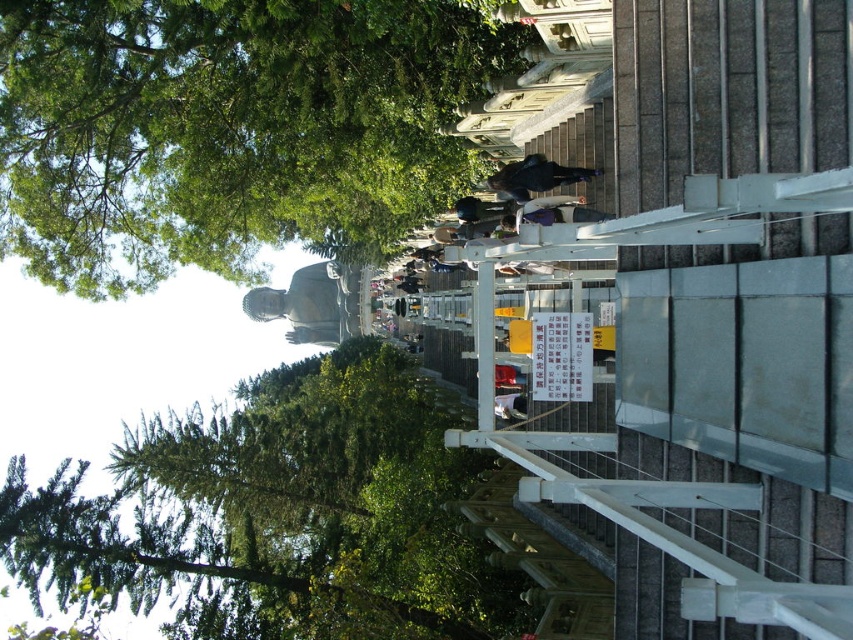
Is the position of green leafy tree at upper left more distant than that of green leafy tree at lower left?

No.

How distant is green leafy tree at upper left from green leafy tree at lower left?

green leafy tree at upper left is 18.46 meters away from green leafy tree at lower left.

Which is in front, point (65, 132) or point (339, 444)?

Point (65, 132)

At what (x,y) coordinates should I click in order to perform the action: click on green leafy tree at upper left. Please return your answer as a coordinate pair (x, y). Looking at the image, I should click on (230, 129).

Can you confirm if green leafy tree at lower left is positioned above dark blue jeans at center?

Actually, green leafy tree at lower left is below dark blue jeans at center.

Which is below, green leafy tree at lower left or dark blue jeans at center?

green leafy tree at lower left

Where is `green leafy tree at lower left`? green leafy tree at lower left is located at coordinates (279, 513).

Is green leafy tree at upper left below matte gray statue at center?

No.

Between green leafy tree at upper left and matte gray statue at center, which one appears on the left side from the viewer's perspective?

Positioned to the left is matte gray statue at center.

Who is more forward, (485, 32) or (270, 300)?

Point (485, 32) is more forward.

I want to click on green leafy tree at upper left, so click(x=230, y=129).